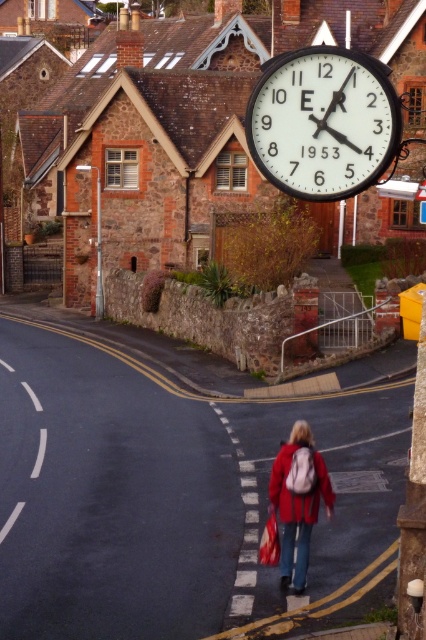
You are standing in the residential street scene and want to locate the black metal clock at upper center. According to the coordinates provided, where exactly should you look to find it?

The black metal clock at upper center is located at coordinates point (322, 122).

You are standing on the sidewalk and see the black metal clock at upper center. If you want to touch it, how many steps do you think you need to take? Assume each step is about 0.75 meters.

The black metal clock at upper center is 9.55 meters away from viewer. Since each step is 0.75 meters, you would need approximately 13 steps to reach it.

You are a pedestrian standing at the crosswalk and want to take a photo of the black metal clock at upper center without the red matte jacket at lower center blocking the view. Is the jacket currently in front of or behind the clock?

The red matte jacket at lower center is behind the black metal clock at upper center, so it won not block the view of the clock.